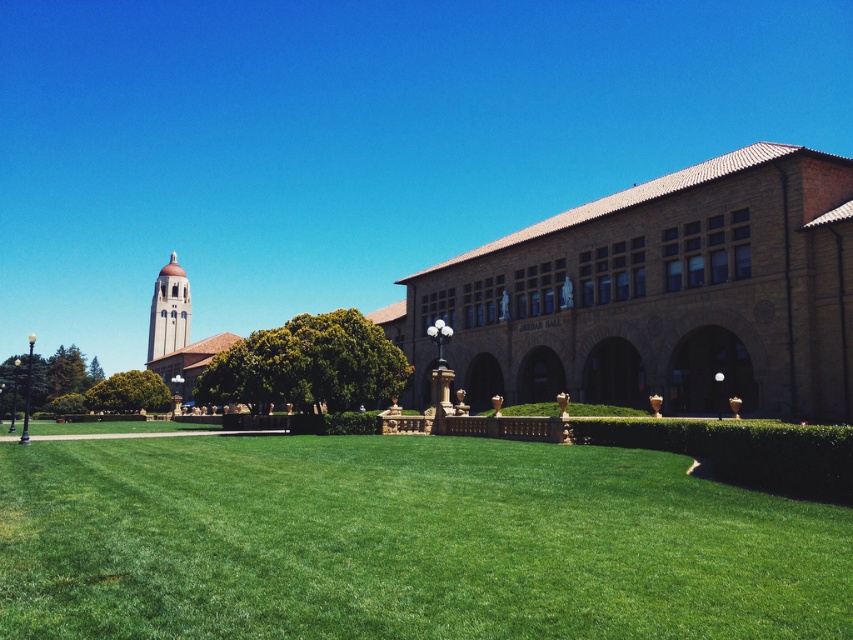
You are a gardener who needs to mow the green grass at center and trim the green leafy hedge at lower left. Based on their heights, which task should you tackle first?

The green grass at center is not as tall as the green leafy hedge at lower left, so you should trim the green leafy hedge at lower left first since it is taller and requires attention before the grass.

You are a gardener planning to plant a row of flowers between the green grass at center and the green leafy hedge at center. Which area has more space available for planting?

The green grass at center has more space available for planting since its width surpasses that of the green leafy hedge at center.

You are standing at the entrance of the campus and want to walk towards the historic building. You see the green grass at center and the green leafy hedge at lower left. Which object is closer to you as you face the building?

The green leafy hedge at lower left is closer to you because it is located below the green grass at center, which is positioned above it.